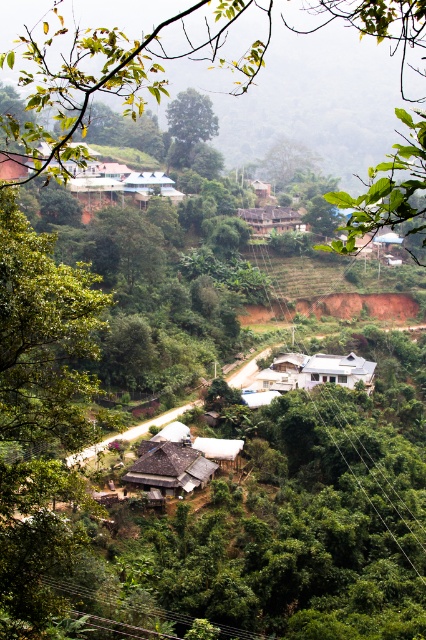
Question: Is white matte house at center further to camera compared to white corrugated metal hut at center?

Choices:
 (A) no
 (B) yes

Answer: (B)

Question: Estimate the real-world distances between objects in this image. Which object is closer to the brown wooden hut at center?

Choices:
 (A) green leafy tree at upper center
 (B) white corrugated metal hut at center
 (C) brown wooden hut at upper center
 (D) white matte house at center

Answer: (B)

Question: Is white matte house at center wider than brown wooden hut at upper center?

Choices:
 (A) no
 (B) yes

Answer: (A)

Question: Is brown wooden hut at center thinner than white corrugated metal hut at center?

Choices:
 (A) yes
 (B) no

Answer: (B)

Question: Which object is farther from the camera taking this photo?

Choices:
 (A) green leafy tree at upper center
 (B) green leafy tree at center
 (C) white corrugated metal hut at center
 (D) brown wooden hut at center

Answer: (B)

Question: Among these objects, which one is farthest from the camera?

Choices:
 (A) white corrugated metal hut at center
 (B) brown wooden hut at center
 (C) green leafy tree at center
 (D) green leafy tree at upper center

Answer: (C)